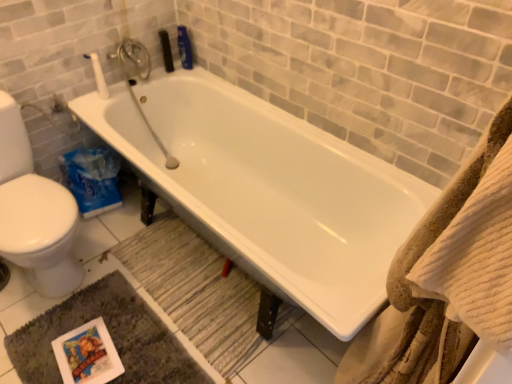
Question: Can you confirm if wooden textured bath mat at lower center, which is the first bath mat in top-to-bottom order, is thinner than dark gray plush bath mat at lower left, arranged as the first bath mat when ordered from the bottom?

Choices:
 (A) no
 (B) yes

Answer: (B)

Question: Is wooden textured bath mat at lower center, which is the first bath mat in top-to-bottom order, further to camera compared to dark gray plush bath mat at lower left, which ranks as the second bath mat in top-to-bottom order?

Choices:
 (A) no
 (B) yes

Answer: (B)

Question: Considering the relative sizes of wooden textured bath mat at lower center, which is the first bath mat in top-to-bottom order, and dark gray plush bath mat at lower left, arranged as the first bath mat when ordered from the bottom, in the image provided, is wooden textured bath mat at lower center, which is the first bath mat in top-to-bottom order, smaller than dark gray plush bath mat at lower left, arranged as the first bath mat when ordered from the bottom,?

Choices:
 (A) no
 (B) yes

Answer: (B)

Question: Does wooden textured bath mat at lower center, which is the first bath mat in top-to-bottom order, have a greater width compared to dark gray plush bath mat at lower left, which ranks as the second bath mat in top-to-bottom order?

Choices:
 (A) yes
 (B) no

Answer: (B)

Question: Is wooden textured bath mat at lower center, which is counted as the 2th bath mat, starting from the bottom, positioned far away from dark gray plush bath mat at lower left, which ranks as the second bath mat in top-to-bottom order?

Choices:
 (A) yes
 (B) no

Answer: (B)

Question: Would you say dark gray plush bath mat at lower left, which ranks as the second bath mat in top-to-bottom order, is part of wooden textured bath mat at lower center, which is the first bath mat in top-to-bottom order,'s contents?

Choices:
 (A) no
 (B) yes

Answer: (A)

Question: Is dark gray plush bath mat at lower left, arranged as the first bath mat when ordered from the bottom, taller than wooden textured bath mat at lower center, which is counted as the 2th bath mat, starting from the bottom?

Choices:
 (A) yes
 (B) no

Answer: (B)

Question: Considering the relative positions of dark gray plush bath mat at lower left, arranged as the first bath mat when ordered from the bottom, and wooden textured bath mat at lower center, which is counted as the 2th bath mat, starting from the bottom, in the image provided, is dark gray plush bath mat at lower left, arranged as the first bath mat when ordered from the bottom, in front of wooden textured bath mat at lower center, which is counted as the 2th bath mat, starting from the bottom,?

Choices:
 (A) no
 (B) yes

Answer: (B)

Question: From the image's perspective, does dark gray plush bath mat at lower left, arranged as the first bath mat when ordered from the bottom, appear lower than wooden textured bath mat at lower center, which is the first bath mat in top-to-bottom order?

Choices:
 (A) yes
 (B) no

Answer: (A)

Question: From a real-world perspective, is dark gray plush bath mat at lower left, which ranks as the second bath mat in top-to-bottom order, on top of wooden textured bath mat at lower center, which is the first bath mat in top-to-bottom order?

Choices:
 (A) yes
 (B) no

Answer: (B)

Question: Is dark gray plush bath mat at lower left, arranged as the first bath mat when ordered from the bottom, touching wooden textured bath mat at lower center, which is counted as the 2th bath mat, starting from the bottom?

Choices:
 (A) no
 (B) yes

Answer: (A)

Question: From a real-world perspective, does dark gray plush bath mat at lower left, which ranks as the second bath mat in top-to-bottom order, sit lower than wooden textured bath mat at lower center, which is the first bath mat in top-to-bottom order?

Choices:
 (A) no
 (B) yes

Answer: (B)

Question: Are dark gray plush bath mat at lower left, which ranks as the second bath mat in top-to-bottom order, and white glossy bathtub at center far apart?

Choices:
 (A) yes
 (B) no

Answer: (B)